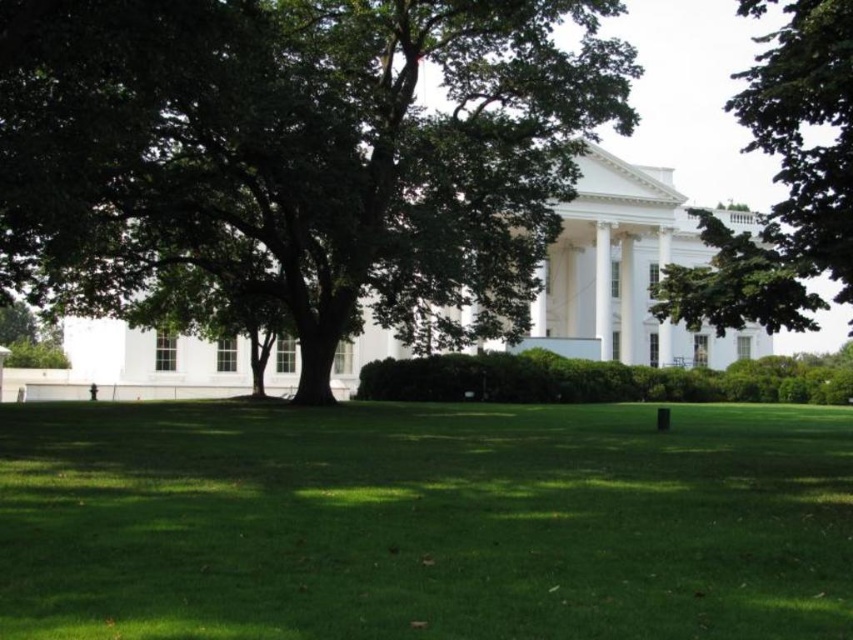
Question: Which is farther from the green leafy tree at upper right?

Choices:
 (A) white smooth pillar at center
 (B) green leafy tree at center
 (C) green grass at center

Answer: (A)

Question: Is green grass at center to the left of green leafy tree at center from the viewer's perspective?

Choices:
 (A) yes
 (B) no

Answer: (A)

Question: Is green leafy tree at center further to the viewer compared to white smooth pillar at center?

Choices:
 (A) no
 (B) yes

Answer: (B)

Question: Which point is closer to the camera taking this photo?

Choices:
 (A) (189, 214)
 (B) (844, 189)
 (C) (660, 252)

Answer: (B)

Question: Observing the image, what is the correct spatial positioning of green leafy tree at center in reference to white smooth pillar at center?

Choices:
 (A) left
 (B) right

Answer: (A)

Question: Which object is positioned closest to the green leafy tree at center?

Choices:
 (A) green grass at center
 (B) white smooth pillar at center

Answer: (A)